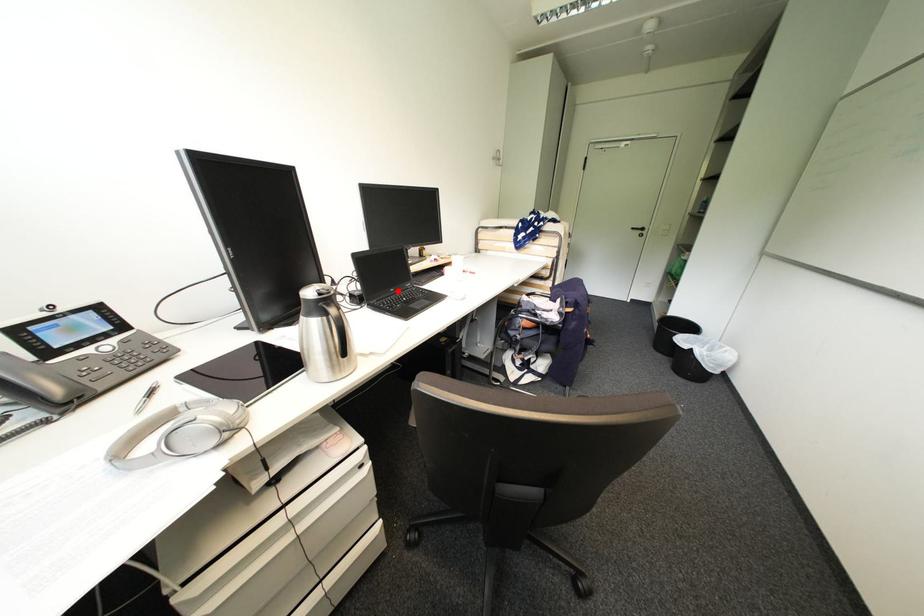
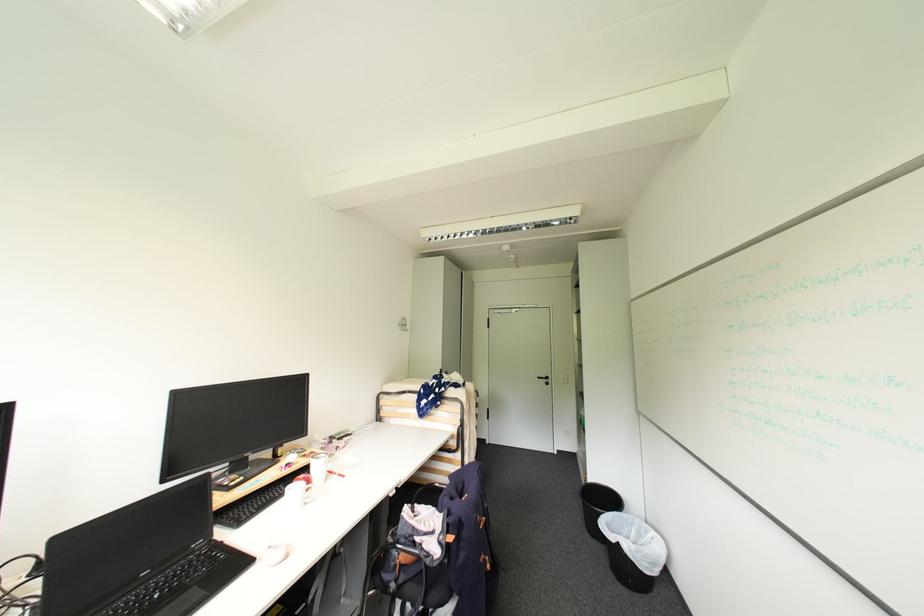
In the second image, find the point that corresponds to the highlighted location in the first image.

(150, 575)